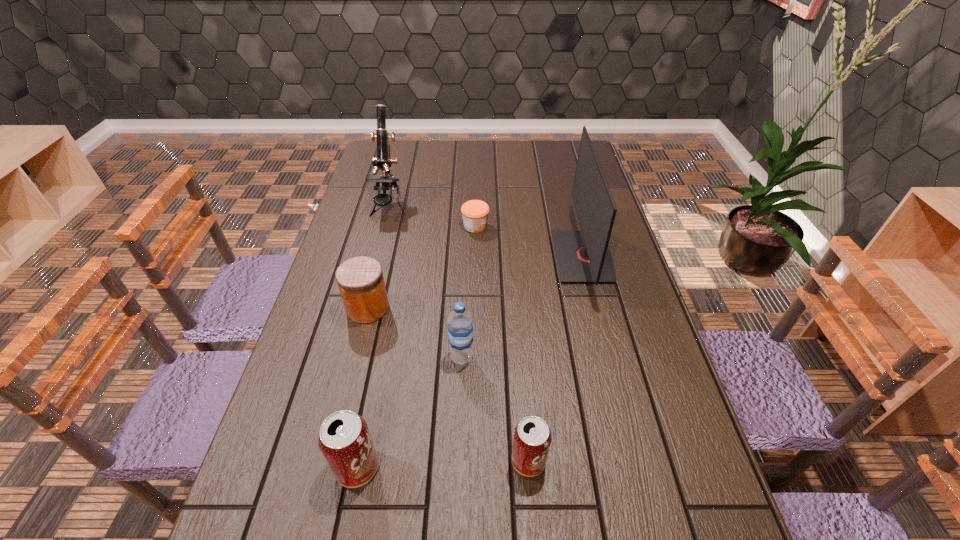
Identify the location of free space between the jar and the sixth object from left to right. (448, 384).

The height and width of the screenshot is (540, 960). What are the coordinates of `vacant area that lies between the shortest object and the shorter soda can` in the screenshot? It's located at (502, 343).

Where is `free space between the microscope and the taller soda can`? Image resolution: width=960 pixels, height=540 pixels. free space between the microscope and the taller soda can is located at coordinates (373, 336).

The height and width of the screenshot is (540, 960). Identify the location of unoccupied position between the taller soda can and the rightmost object. [470, 362].

Find the location of a particular element. free space between the jar and the second object from right to left is located at coordinates (448, 384).

Locate an element on the screen. This screenshot has height=540, width=960. vacant space that's between the shortest object and the jar is located at coordinates (421, 267).

Identify the location of the second closest object relative to the water bottle. (532, 437).

Identify which object is the fourth closest to the shortest object. Please provide its 2D coordinates. Your answer should be formatted as a tuple, i.e. [(x, y)], where the tuple contains the x and y coordinates of a point satisfying the conditions above.

[(460, 325)]

Locate an element on the screen. free space that satisfies the following two spatial constraints: 1. on the screen side of the monitor; 2. on the label of the water bottle is located at coordinates (609, 357).

You are a GUI agent. You are given a task and a screenshot of the screen. Output one action in this format:
    pyautogui.click(x=<x>, y=<y>)
    Task: Click on the free space that satisfies the following two spatial constraints: 1. on the front label of the second object from right to left; 2. on the right side of the shortest object
    This screenshot has height=540, width=960.
    Given the screenshot: What is the action you would take?
    pyautogui.click(x=472, y=461)